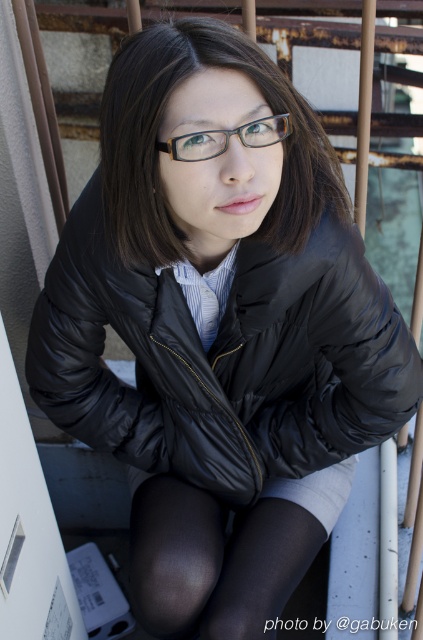
Question: Where is matte black jacket at center located in relation to clear plastic glasses at center in the image?

Choices:
 (A) right
 (B) left

Answer: (B)

Question: Which object is positioned closest to the clear plastic glasses at center?

Choices:
 (A) black tights at lower center
 (B) matte black jacket at center

Answer: (B)

Question: Does matte black jacket at center have a lesser width compared to black tights at lower center?

Choices:
 (A) no
 (B) yes

Answer: (B)

Question: Among these points, which one is farthest from the camera?

Choices:
 (A) (241, 589)
 (B) (200, 141)
 (C) (250, 72)

Answer: (A)

Question: Based on their relative distances, which object is farther from the black tights at lower center?

Choices:
 (A) clear plastic glasses at center
 (B) matte black jacket at center

Answer: (A)

Question: Can you confirm if black tights at lower center is smaller than clear plastic glasses at center?

Choices:
 (A) yes
 (B) no

Answer: (B)